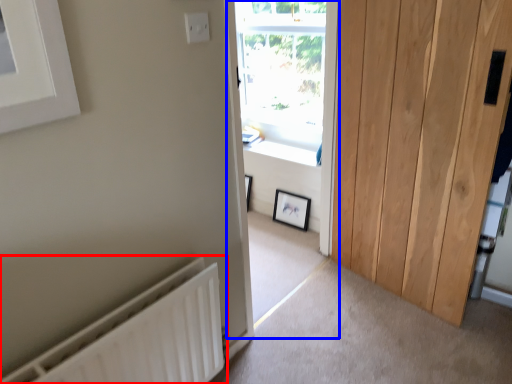
Question: Which of the following is the closest to the observer, radiator (highlighted by a red box) or window frame (highlighted by a blue box)?

Choices:
 (A) radiator
 (B) window frame

Answer: (A)